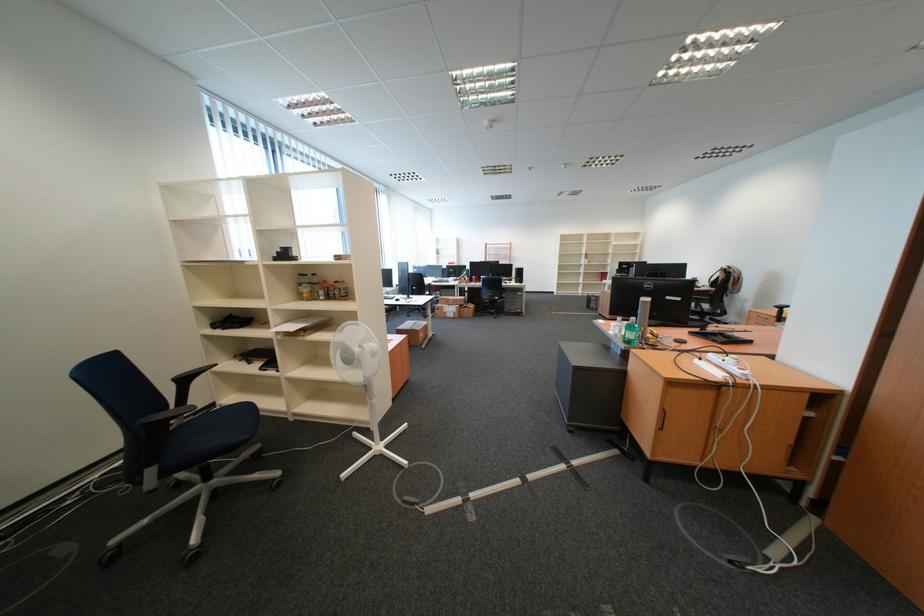
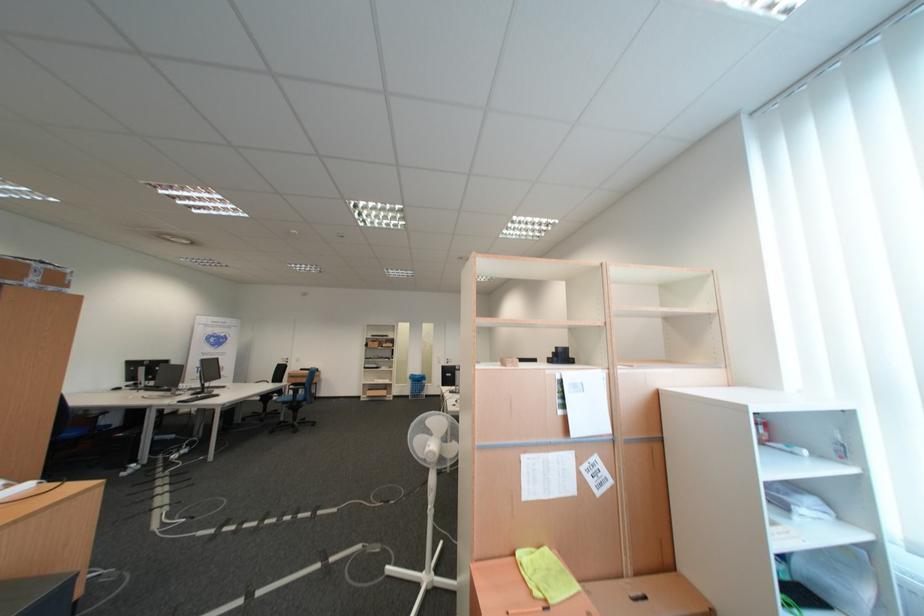
Find the pixel in the second image that matches the point at 391,448 in the first image.

(439, 578)